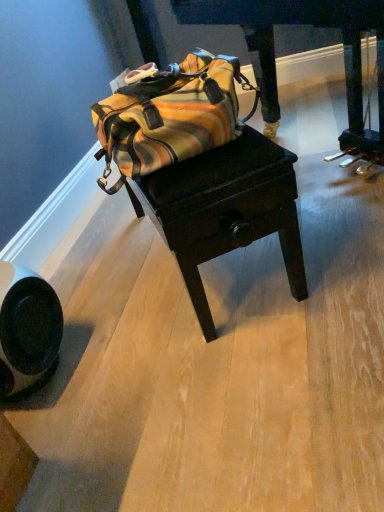
Question: Is wooden table at center closer to the viewer compared to dark wood drawer at center?

Choices:
 (A) yes
 (B) no

Answer: (B)

Question: Is wooden table at center beside dark wood drawer at center?

Choices:
 (A) no
 (B) yes

Answer: (A)

Question: Considering the relative sizes of wooden table at center and dark wood drawer at center in the image provided, is wooden table at center thinner than dark wood drawer at center?

Choices:
 (A) yes
 (B) no

Answer: (A)

Question: Is wooden table at center bigger than dark wood drawer at center?

Choices:
 (A) yes
 (B) no

Answer: (B)

Question: From a real-world perspective, is wooden table at center below dark wood drawer at center?

Choices:
 (A) no
 (B) yes

Answer: (B)

Question: Does point (259, 74) appear closer or farther from the camera than point (198, 210)?

Choices:
 (A) closer
 (B) farther

Answer: (B)

Question: Is dark wood drawer at center to the left or to the right of wooden table at center in the image?

Choices:
 (A) left
 (B) right

Answer: (B)

Question: Considering the positions of dark wood drawer at center and wooden table at center in the image, is dark wood drawer at center wider or thinner than wooden table at center?

Choices:
 (A) wide
 (B) thin

Answer: (A)

Question: Is dark wood drawer at center situated inside wooden table at center or outside?

Choices:
 (A) inside
 (B) outside

Answer: (B)

Question: Which is correct: wooden table at center is inside striped canvas duffel bag at center, or outside of it?

Choices:
 (A) inside
 (B) outside

Answer: (B)

Question: Does point (216, 154) appear closer or farther from the camera than point (155, 101)?

Choices:
 (A) farther
 (B) closer

Answer: (A)

Question: Is wooden table at center in front of or behind striped canvas duffel bag at center in the image?

Choices:
 (A) behind
 (B) front

Answer: (A)

Question: From their relative heights in the image, would you say wooden table at center is taller or shorter than striped canvas duffel bag at center?

Choices:
 (A) tall
 (B) short

Answer: (A)

Question: From a real-world perspective, is striped canvas duffel bag at center above or below wooden table at center?

Choices:
 (A) below
 (B) above

Answer: (B)

Question: Based on their positions, is striped canvas duffel bag at center located to the left or right of wooden table at center?

Choices:
 (A) right
 (B) left

Answer: (B)